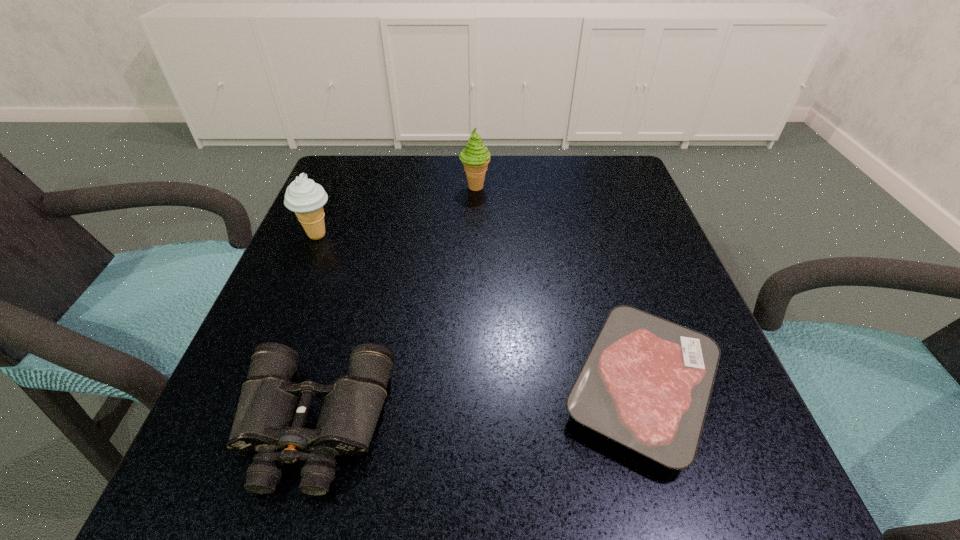
Locate an element on the screen. The height and width of the screenshot is (540, 960). vacant region between the second farthest object and the rightmost object is located at coordinates (480, 311).

This screenshot has width=960, height=540. I want to click on vacant space that is in between the binoculars and the shortest object, so pyautogui.click(x=478, y=406).

Find the location of `vacant area that lies between the shortest object and the binoculars`. vacant area that lies between the shortest object and the binoculars is located at coordinates (478, 406).

The height and width of the screenshot is (540, 960). Find the location of `free spot between the third tallest object and the second farthest object`. free spot between the third tallest object and the second farthest object is located at coordinates (316, 330).

Identify the location of object that is the closest to the binoculars. The height and width of the screenshot is (540, 960). (646, 383).

Locate which object ranks second in proximity to the rightmost object. Please provide its 2D coordinates. Your answer should be formatted as a tuple, i.e. [(x, y)], where the tuple contains the x and y coordinates of a point satisfying the conditions above.

[(475, 157)]

Locate an element on the screen. free spot that satisfies the following two spatial constraints: 1. on the back side of the nearer icecream; 2. on the right side of the farther icecream is located at coordinates (338, 187).